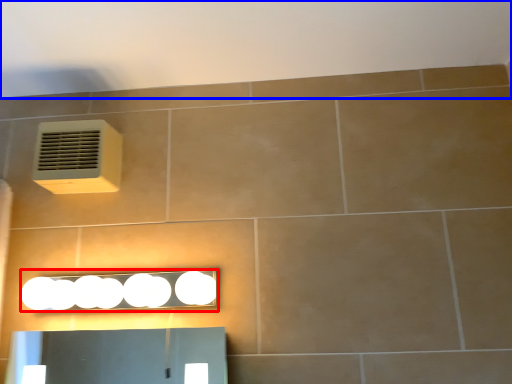
Question: Which of the following is the closest to the observer, light fixture (highlighted by a red box) or backdrop (highlighted by a blue box)?

Choices:
 (A) light fixture
 (B) backdrop

Answer: (B)